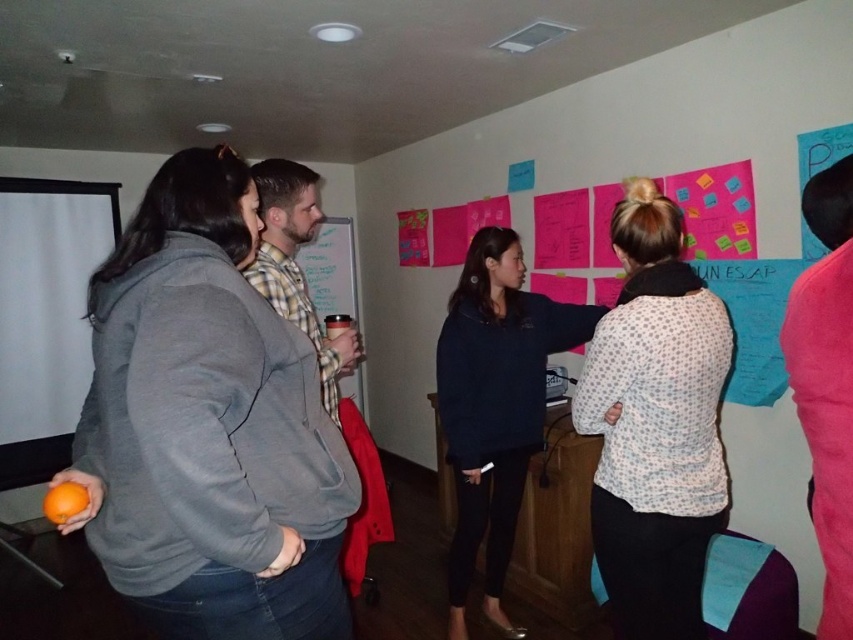
You are organizing a snack table for the meeting and need to place the orange matte at lower left and the matte plastic cup at center. Since the cup is larger, where should you place the smaller item to ensure stability?

The orange matte at lower left is smaller than the matte plastic cup at center, so placing the smaller item on top of the larger one would provide better stability.

You are organizing a fruit basket and need to place the orange matte at lower left and the matte plastic cup at center into a box. Which object should you place first to ensure they fit properly?

The orange matte at lower left should be placed first since it is positioned on the left side of the matte plastic cup at center, so placing it first ensures proper alignment.

You are standing in the meeting room and want to hand a document to the person wearing the dark blue sweater at center and the plaid fabric shirt at center. Which one can you reach first without moving?

You can reach the dark blue sweater at center first because it is closer to you than the plaid fabric shirt at center.